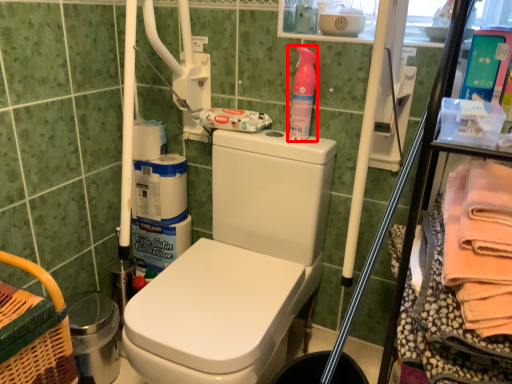
Question: From the image's perspective, what is the correct spatial relationship of cleaning product (annotated by the red box) in relation to material?

Choices:
 (A) above
 (B) below

Answer: (A)